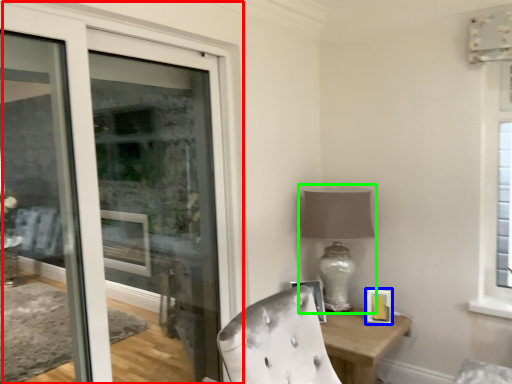
Question: Which object is positioned farthest from door (highlighted by a red box)? Select from picture frame (highlighted by a blue box) and table lamp (highlighted by a green box).

Choices:
 (A) picture frame
 (B) table lamp

Answer: (A)